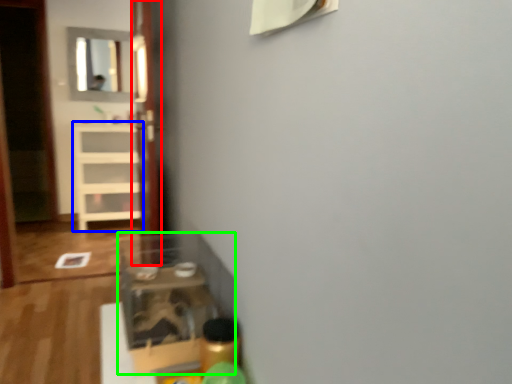
Question: Considering the real-world distances, which object is closest to glass door (highlighted by a red box)? shelf (highlighted by a blue box) or shelf (highlighted by a green box).

Choices:
 (A) shelf
 (B) shelf

Answer: (B)